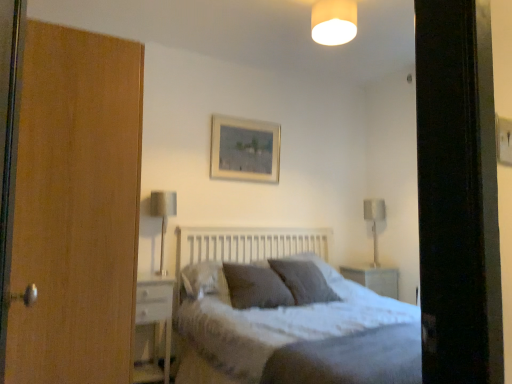
Question: Can you confirm if white glossy nightstand at lower left is thinner than textured gray pillow at center, which is the 2th pillow in front-to-back order?

Choices:
 (A) yes
 (B) no

Answer: (A)

Question: From a real-world perspective, does white glossy nightstand at lower left sit lower than textured gray pillow at center, the second pillow viewed from the back?

Choices:
 (A) no
 (B) yes

Answer: (B)

Question: Is white glossy nightstand at lower left shorter than textured gray pillow at center, the second pillow viewed from the back?

Choices:
 (A) no
 (B) yes

Answer: (A)

Question: Considering the relative sizes of white glossy nightstand at lower left and textured gray pillow at center, the second pillow viewed from the back, in the image provided, is white glossy nightstand at lower left taller than textured gray pillow at center, the second pillow viewed from the back,?

Choices:
 (A) no
 (B) yes

Answer: (B)

Question: From the image's perspective, is white glossy nightstand at lower left under textured gray pillow at center, the second pillow viewed from the back?

Choices:
 (A) yes
 (B) no

Answer: (A)

Question: In terms of height, does textured gray bed at center look taller or shorter compared to metallic silver table lamp at right, which is the 1th table lamp in right-to-left order?

Choices:
 (A) tall
 (B) short

Answer: (A)

Question: Is point (369, 327) closer or farther from the camera than point (373, 218)?

Choices:
 (A) farther
 (B) closer

Answer: (B)

Question: Considering the positions of textured gray bed at center and metallic silver table lamp at right, which ranks as the second table lamp in front-to-back order, in the image, is textured gray bed at center bigger or smaller than metallic silver table lamp at right, which ranks as the second table lamp in front-to-back order,?

Choices:
 (A) small
 (B) big

Answer: (B)

Question: From a real-world perspective, is textured gray bed at center physically located above or below metallic silver table lamp at right, which ranks as the second table lamp in front-to-back order?

Choices:
 (A) above
 (B) below

Answer: (B)

Question: Considering the positions of textured gray bed at center and matte white lampshade at upper center in the image, is textured gray bed at center bigger or smaller than matte white lampshade at upper center?

Choices:
 (A) small
 (B) big

Answer: (B)

Question: In terms of height, does textured gray bed at center look taller or shorter compared to matte white lampshade at upper center?

Choices:
 (A) short
 (B) tall

Answer: (B)

Question: Considering their positions, is textured gray bed at center located in front of or behind matte white lampshade at upper center?

Choices:
 (A) front
 (B) behind

Answer: (A)

Question: Is textured gray bed at center inside the boundaries of matte white lampshade at upper center, or outside?

Choices:
 (A) inside
 (B) outside

Answer: (B)

Question: From their relative heights in the image, would you say textured gray bed at center is taller or shorter than textured gray pillow at center, placed as the 1th pillow when sorted from front to back?

Choices:
 (A) short
 (B) tall

Answer: (B)

Question: Looking at the image, does textured gray bed at center seem bigger or smaller compared to textured gray pillow at center, the third pillow when ordered from back to front?

Choices:
 (A) big
 (B) small

Answer: (A)